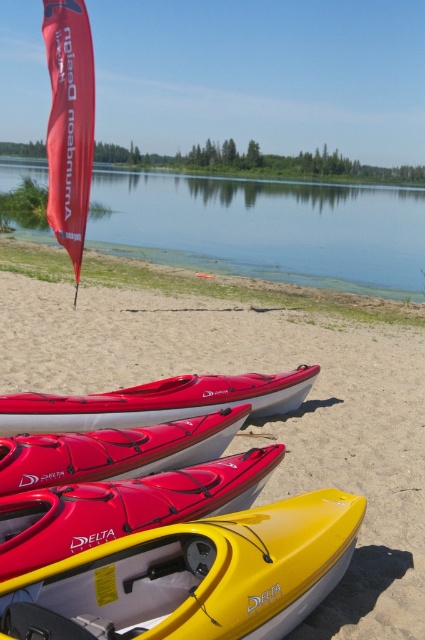
Question: Observing the image, what is the correct spatial positioning of transparent water at center in reference to yellow matte kayak at center?

Choices:
 (A) left
 (B) right

Answer: (B)

Question: Does yellow matte kayak at lower center appear on the right side of yellow glossy kayak at lower center?

Choices:
 (A) yes
 (B) no

Answer: (A)

Question: Does matte red kayak at center have a greater width compared to shiny red kayak at center?

Choices:
 (A) yes
 (B) no

Answer: (A)

Question: Which object is positioned closest to the matte red kayak at center?

Choices:
 (A) transparent water at center
 (B) yellow glossy kayak at lower center

Answer: (B)

Question: Based on their relative distances, which object is farther from the shiny red kayak at center?

Choices:
 (A) matte red kayak at center
 (B) yellow matte kayak at center

Answer: (A)

Question: Which of these objects is positioned farthest from the yellow matte kayak at lower center?

Choices:
 (A) yellow matte kayak at center
 (B) matte red kayak at center

Answer: (A)